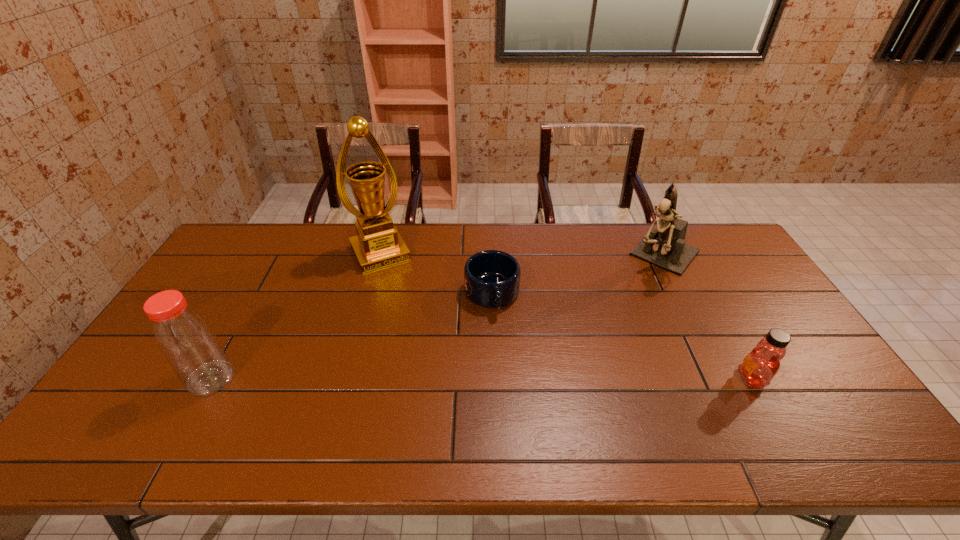
This screenshot has width=960, height=540. Find the location of `vacant area that lies between the mug and the tallest object`. vacant area that lies between the mug and the tallest object is located at coordinates (436, 274).

The height and width of the screenshot is (540, 960). I want to click on empty space between the award and the third object from left to right, so click(x=436, y=274).

At what (x,y) coordinates should I click in order to perform the action: click on free point between the second shortest object and the second tallest object. Please return your answer as a coordinate pair (x, y). The image size is (960, 540). Looking at the image, I should click on (708, 317).

Locate an element on the screen. This screenshot has height=540, width=960. free spot between the second object from left to right and the second shortest object is located at coordinates (566, 315).

The height and width of the screenshot is (540, 960). What are the coordinates of `free spot between the honey and the mug` in the screenshot? It's located at (622, 336).

The width and height of the screenshot is (960, 540). In order to click on the closest object to the figurine in this screenshot , I will do `click(759, 367)`.

Identify which object is the second closest to the third tallest object. Please provide its 2D coordinates. Your answer should be formatted as a tuple, i.e. [(x, y)], where the tuple contains the x and y coordinates of a point satisfying the conditions above.

[(491, 278)]

Identify the location of vacant region that satisfies the following two spatial constraints: 1. on the back side of the second tallest object; 2. on the left side of the bottle. This screenshot has height=540, width=960. (279, 255).